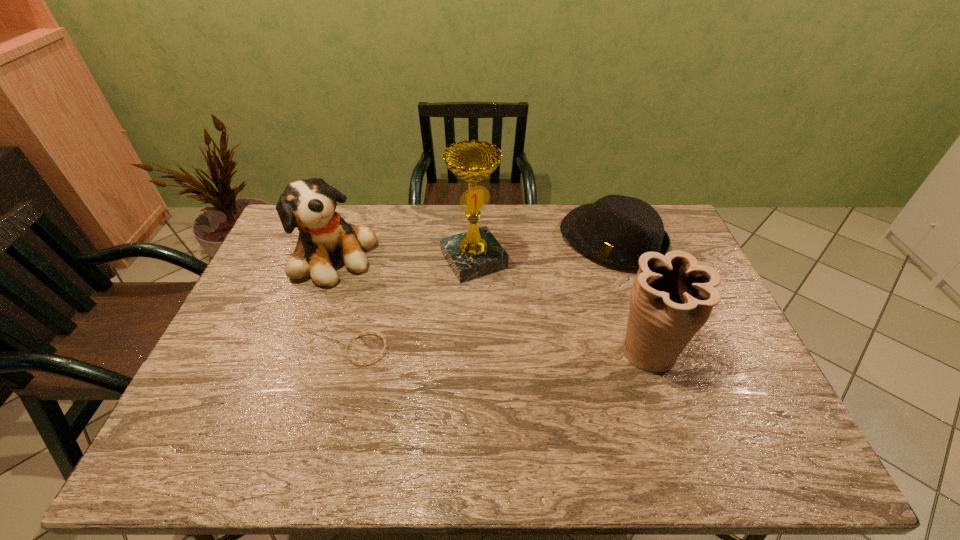
In the image, there is a desktop. Where is `vacant space at the right edge`? vacant space at the right edge is located at coordinates (728, 361).

The image size is (960, 540). Find the location of `empty location between the tallest object and the shortest object`. empty location between the tallest object and the shortest object is located at coordinates (420, 305).

At what (x,y) coordinates should I click in order to perform the action: click on empty space that is in between the bracelet and the fedora. Please return your answer as a coordinate pair (x, y). The width and height of the screenshot is (960, 540). Looking at the image, I should click on (490, 294).

At what (x,y) coordinates should I click in order to perform the action: click on free space between the urn and the tallest object. Please return your answer as a coordinate pair (x, y). The width and height of the screenshot is (960, 540). Looking at the image, I should click on (562, 305).

The height and width of the screenshot is (540, 960). I want to click on free spot between the third object from left to right and the shortest object, so click(x=420, y=305).

Locate an element on the screen. vacant area that lies between the puppy and the urn is located at coordinates (492, 303).

I want to click on empty location between the tallest object and the shortest object, so click(x=420, y=305).

Locate an element on the screen. This screenshot has width=960, height=540. empty space that is in between the third object from left to right and the puppy is located at coordinates (404, 258).

The height and width of the screenshot is (540, 960). Identify the location of free point between the urn and the fedora. (631, 295).

Select which object appears as the fourth closest to the puppy. Please provide its 2D coordinates. Your answer should be formatted as a tuple, i.e. [(x, y)], where the tuple contains the x and y coordinates of a point satisfying the conditions above.

[(672, 297)]